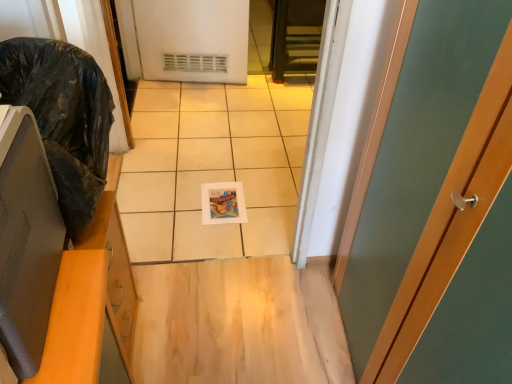
Question: Can black plastic bag at left be found inside matte black monitor at left?

Choices:
 (A) no
 (B) yes

Answer: (A)

Question: Is matte black monitor at left at the right side of black plastic bag at left?

Choices:
 (A) yes
 (B) no

Answer: (A)

Question: Is matte black monitor at left in contact with black plastic bag at left?

Choices:
 (A) no
 (B) yes

Answer: (A)

Question: Can you confirm if matte black monitor at left is bigger than black plastic bag at left?

Choices:
 (A) yes
 (B) no

Answer: (B)

Question: From a real-world perspective, is matte black monitor at left over black plastic bag at left?

Choices:
 (A) yes
 (B) no

Answer: (A)

Question: Considering the relative sizes of matte black monitor at left and black plastic bag at left in the image provided, is matte black monitor at left shorter than black plastic bag at left?

Choices:
 (A) yes
 (B) no

Answer: (A)

Question: Can you see black plastic bag at left touching matte black monitor at left?

Choices:
 (A) yes
 (B) no

Answer: (B)

Question: Does black plastic bag at left appear on the right side of matte black monitor at left?

Choices:
 (A) yes
 (B) no

Answer: (B)

Question: Does black plastic bag at left appear on the left side of matte black monitor at left?

Choices:
 (A) no
 (B) yes

Answer: (B)

Question: Is black plastic bag at left not near matte black monitor at left?

Choices:
 (A) no
 (B) yes

Answer: (A)

Question: Is the depth of black plastic bag at left greater than that of matte black monitor at left?

Choices:
 (A) yes
 (B) no

Answer: (A)

Question: From the image's perspective, is black plastic bag at left on top of matte black monitor at left?

Choices:
 (A) yes
 (B) no

Answer: (A)

Question: Is black plastic bag at left situated inside matte black monitor at left or outside?

Choices:
 (A) inside
 (B) outside

Answer: (B)